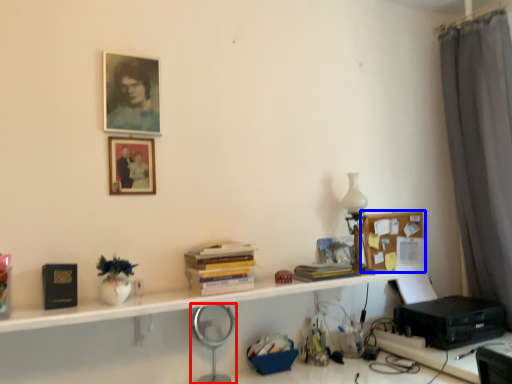
Question: Which point is closer to the camera, magnifying glass (highlighted by a red box) or bulletin board (highlighted by a blue box)?

Choices:
 (A) magnifying glass
 (B) bulletin board

Answer: (A)